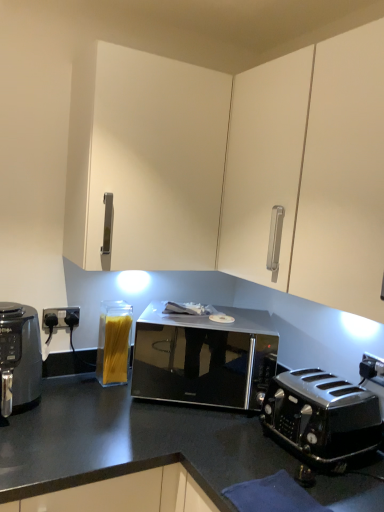
Where is `free spot above polished black toaster at lower right (from a real-world perspective)`? free spot above polished black toaster at lower right (from a real-world perspective) is located at coordinates (340, 392).